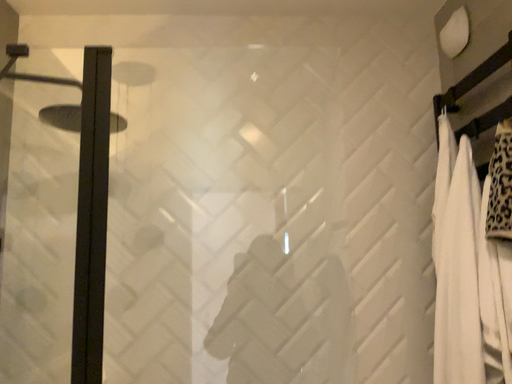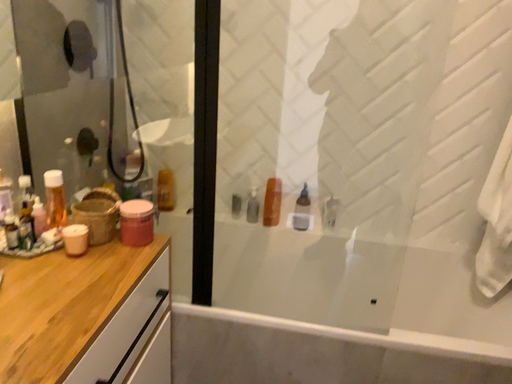
Question: Which way did the camera rotate in the video?

Choices:
 (A) rotated right
 (B) rotated left

Answer: (B)